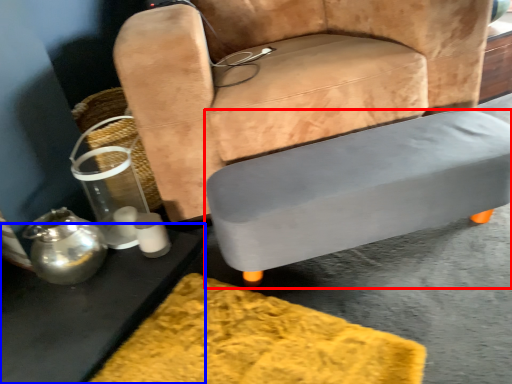
Question: Which object is closer to the camera taking this photo, table (highlighted by a red box) or table (highlighted by a blue box)?

Choices:
 (A) table
 (B) table

Answer: (B)